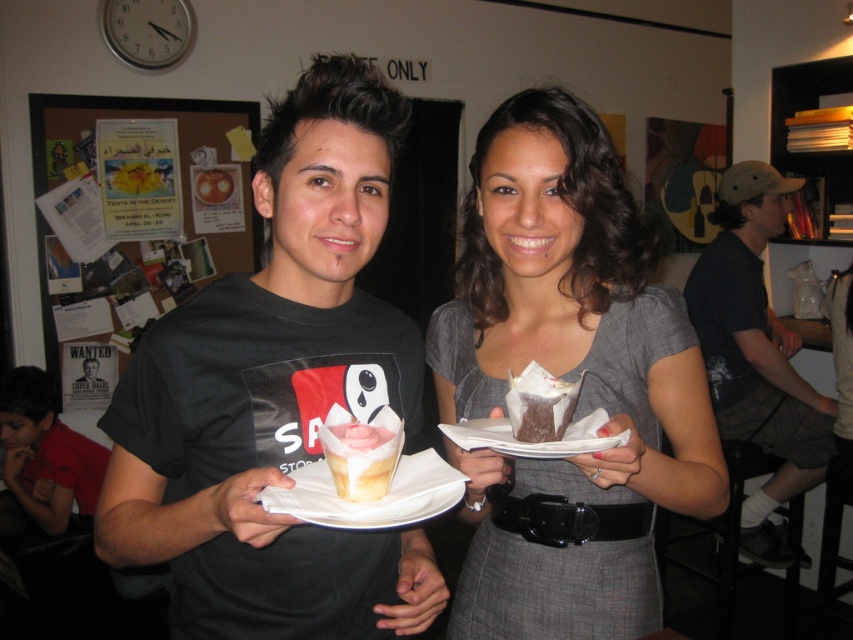
Is matte black t-shirt at center thinner than white paper plate at center?

No, matte black t-shirt at center is not thinner than white paper plate at center.

Is point (187, 570) closer to camera compared to point (511, 436)?

No, (187, 570) is further to viewer.

The height and width of the screenshot is (640, 853). Find the location of `matte black t-shirt at center`. matte black t-shirt at center is located at coordinates (277, 394).

Which of these two, matte black t-shirt at center or matte gray dress at center, stands shorter?

With less height is matte black t-shirt at center.

Which is above, matte black t-shirt at center or matte gray dress at center?

matte black t-shirt at center is higher up.

Is point (171, 380) positioned after point (631, 452)?

Yes, it is behind point (631, 452).

Locate an element on the screen. The width and height of the screenshot is (853, 640). matte black t-shirt at center is located at coordinates (277, 394).

Which is above, matte black t-shirt at center or dark gray shorts at right?

Positioned higher is matte black t-shirt at center.

Measure the distance between matte black t-shirt at center and dark gray shorts at right.

matte black t-shirt at center and dark gray shorts at right are 1.91 meters apart from each other.

This screenshot has height=640, width=853. What are the coordinates of `matte black t-shirt at center` in the screenshot? It's located at (277, 394).